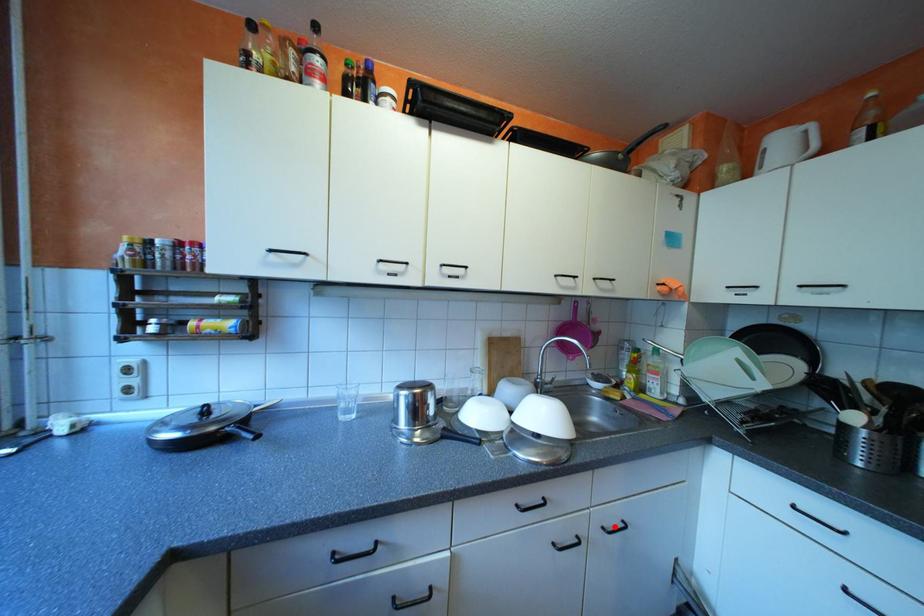
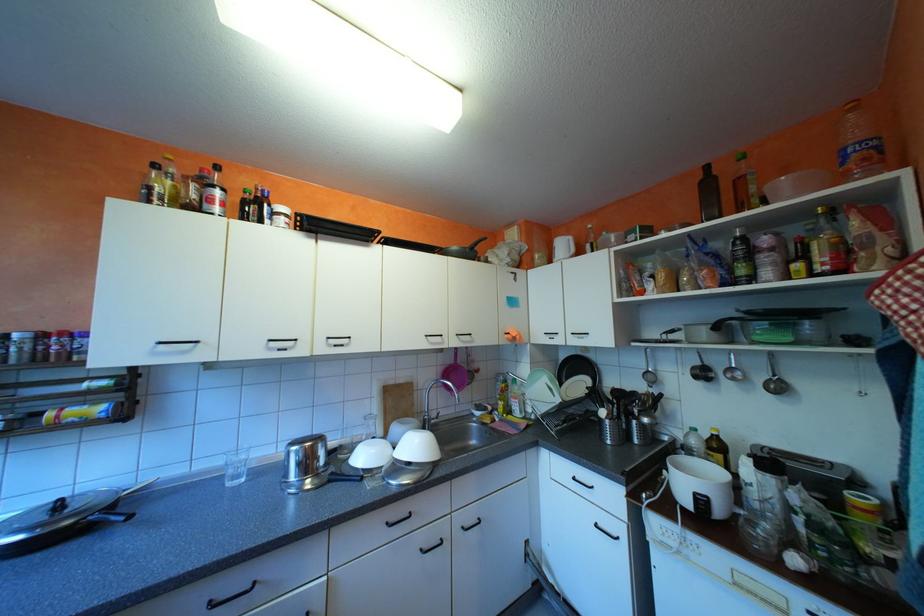
Question: I am providing you with two images of the same scene from different viewpoints. Given a red point in image1, look at the same physical point in image2. Is it:

Choices:
 (A) Closer to the viewpoint
 (B) Farther from the viewpoint

Answer: (B)